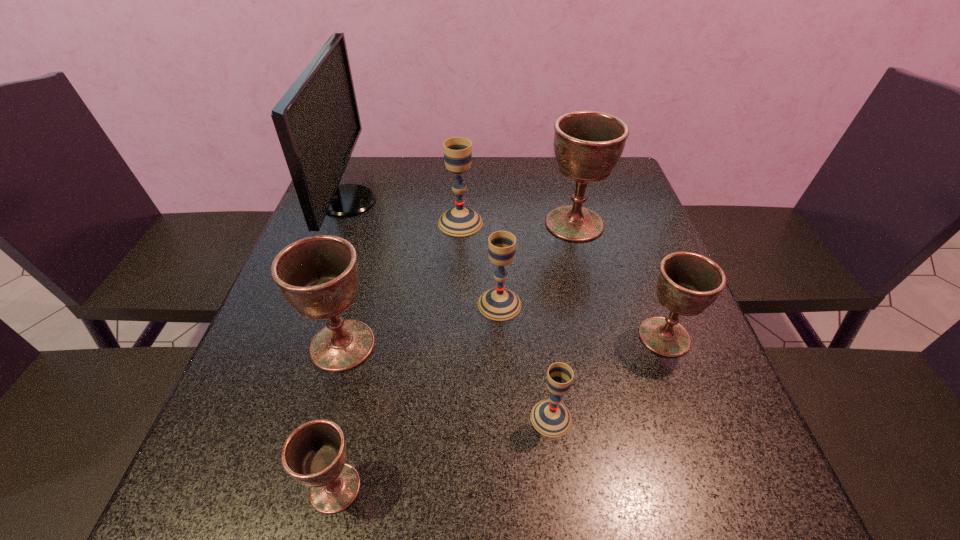
You are a GUI agent. You are given a task and a screenshot of the screen. Output one action in this format:
    pyautogui.click(x=<x>, y=<y>)
    Task: Click on the computer monitor
    This screenshot has height=540, width=960.
    Given the screenshot: What is the action you would take?
    pyautogui.click(x=317, y=121)

Find the location of `the tallest object`. the tallest object is located at coordinates (317, 121).

You are a GUI agent. You are given a task and a screenshot of the screen. Output one action in this format:
    pyautogui.click(x=<x>, y=<y>)
    Task: Click on the farthest brown chalice
    
    Given the screenshot: What is the action you would take?
    pyautogui.click(x=587, y=144)

Where is `the seventh shortest object`? This screenshot has height=540, width=960. the seventh shortest object is located at coordinates (587, 144).

Where is `the farthest gray chalice`? The height and width of the screenshot is (540, 960). the farthest gray chalice is located at coordinates (459, 221).

Locate an element on the screen. The image size is (960, 540). the second biggest brown chalice is located at coordinates (318, 275).

Locate an element on the screen. This screenshot has height=540, width=960. the second nearest gray chalice is located at coordinates (500, 304).

Locate an element on the screen. the third biggest brown chalice is located at coordinates (687, 283).

At what (x,y) coordinates should I click in order to perform the action: click on the second nearest chalice. Please return your answer as a coordinate pair (x, y). Image resolution: width=960 pixels, height=540 pixels. Looking at the image, I should click on (551, 418).

Where is `the seventh farthest object`? the seventh farthest object is located at coordinates (551, 418).